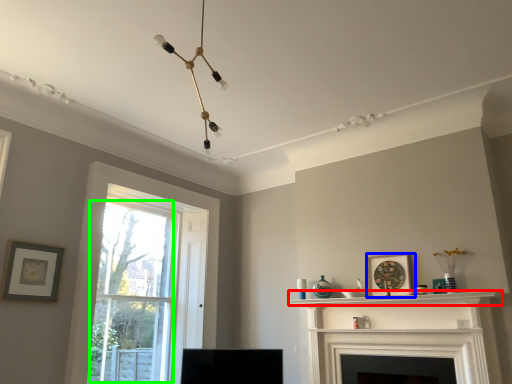
Question: Based on their relative distances, which object is nearer to shelf (highlighted by a red box)? Choose from picture frame (highlighted by a blue box) and bay window (highlighted by a green box).

Choices:
 (A) picture frame
 (B) bay window

Answer: (A)